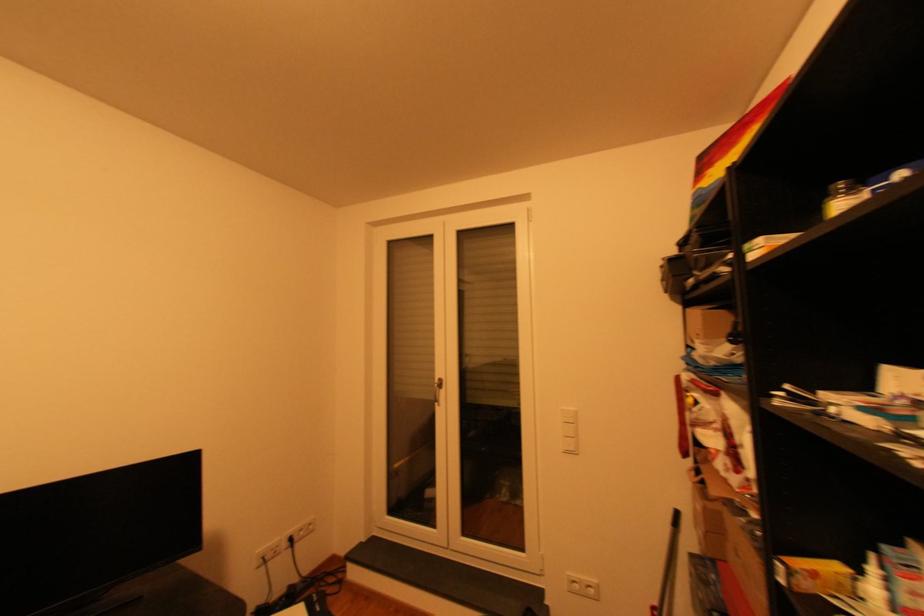
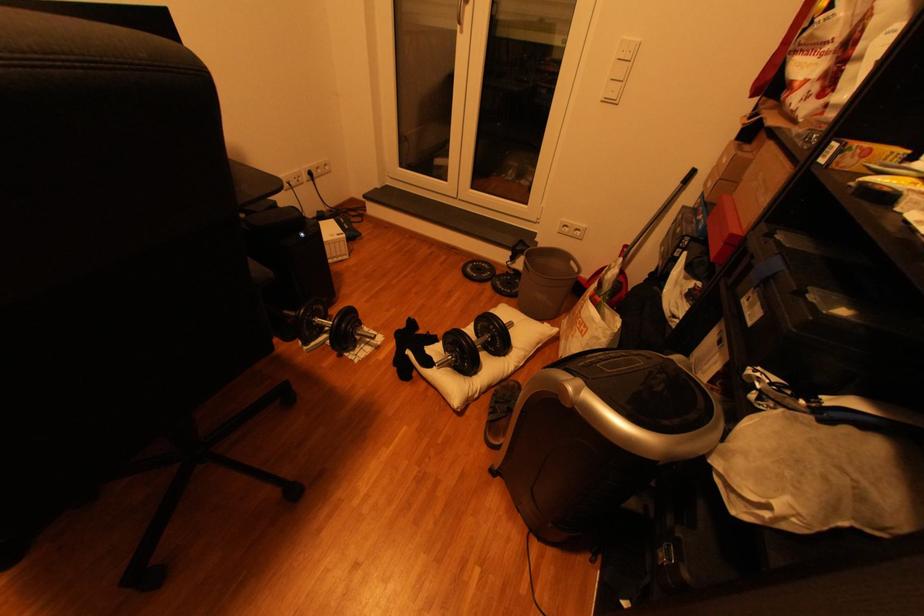
In the second image, find the point that corresponds to point (576, 453) in the first image.

(614, 100)